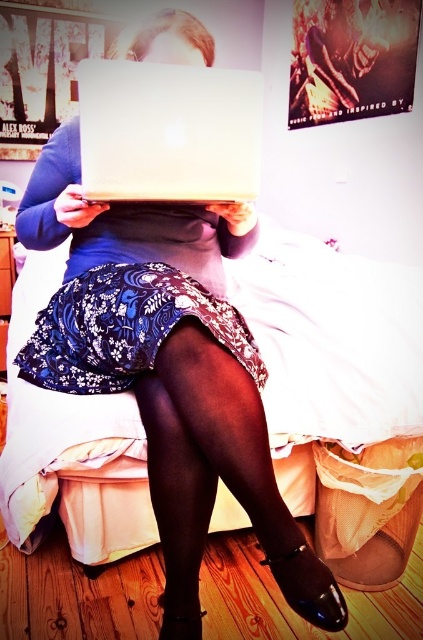
From the picture: Who is positioned more to the left, black patent leather shoes at lower center or white matte laptop at center?

white matte laptop at center

Is black patent leather shoes at lower center above white matte laptop at center?

Actually, black patent leather shoes at lower center is below white matte laptop at center.

Between point (206, 385) and point (216, 196), which one is positioned behind?

The point (216, 196) is more distant.

The width and height of the screenshot is (423, 640). What are the coordinates of `black patent leather shoes at lower center` in the screenshot? It's located at (219, 476).